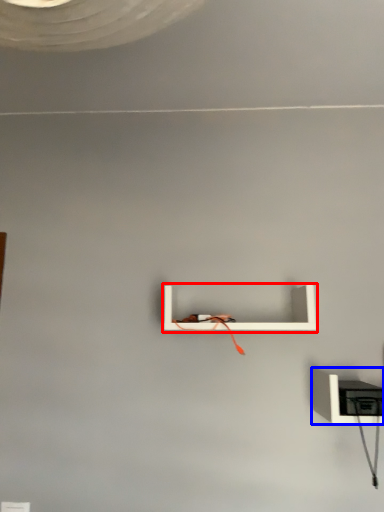
Question: Which of the following is the farthest to the observer, shelf (highlighted by a red box) or shelf (highlighted by a blue box)?

Choices:
 (A) shelf
 (B) shelf

Answer: (A)